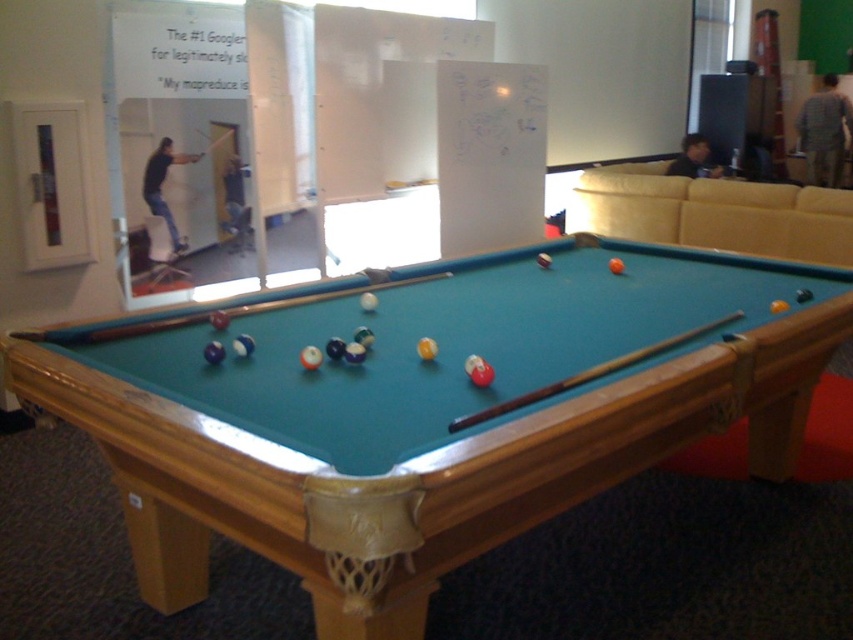
You are playing pool and want to position your cue ball between the two points marked on the table. The points are labeled as point 1 at coordinates point (820, 177) and point 2 at coordinates point (705, 161). Which point should you aim for to ensure the cue ball stays behind the other point?

Point 1 at coordinates point (820, 177) is behind point (705, 161), so you should aim for point 1 to keep the cue ball behind point 2.

You are a pool player trying to place your wooden smooth cue at center on the table without blocking the gray plaid shirt at upper right. Can you fit both items on the table?

The wooden smooth cue at center occupies less space than the gray plaid shirt at upper right, so both items can fit on the table as there is enough space for both.